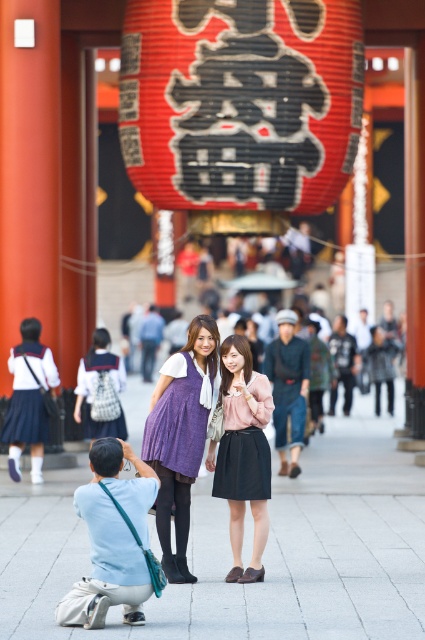
You are a photographer trying to position two women wearing purple dresses for a photo. The women are wearing a purple textured dress at center and a matte purple dress at center. Which dress is positioned to the left of the other?

The purple textured dress at center is positioned to the left of the matte purple dress at center.

You are standing at the entrance of the shrine and want to take a photo of the red paper lantern at upper center. If your camera has a maximum focus range of 150 feet, will you be able to capture the lantern clearly?

The red paper lantern at upper center is 147.27 feet away from the camera. Since this distance is within the camera maximum focus range of 150 feet, the camera can focus on the red paper lantern at upper center clearly.

You are standing at the point marked as point [181,436] in the image. Looking around, you see a purple textured dress at center and the vibrant red torii gate in the background. Which object is closer to you?

The point [181,436] is on the purple textured dress at center, so the purple textured dress at center is closer to you than the vibrant red torii gate in the background.